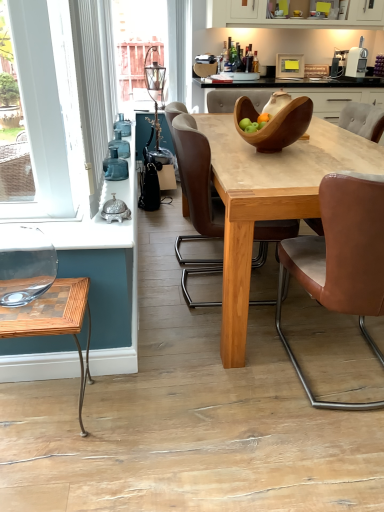
Find the location of a particular element. The image size is (384, 512). vacant space underneath brown leather chair at center, arranged as the 2th chair when viewed from the right (from a real-world perspective) is located at coordinates pos(342,382).